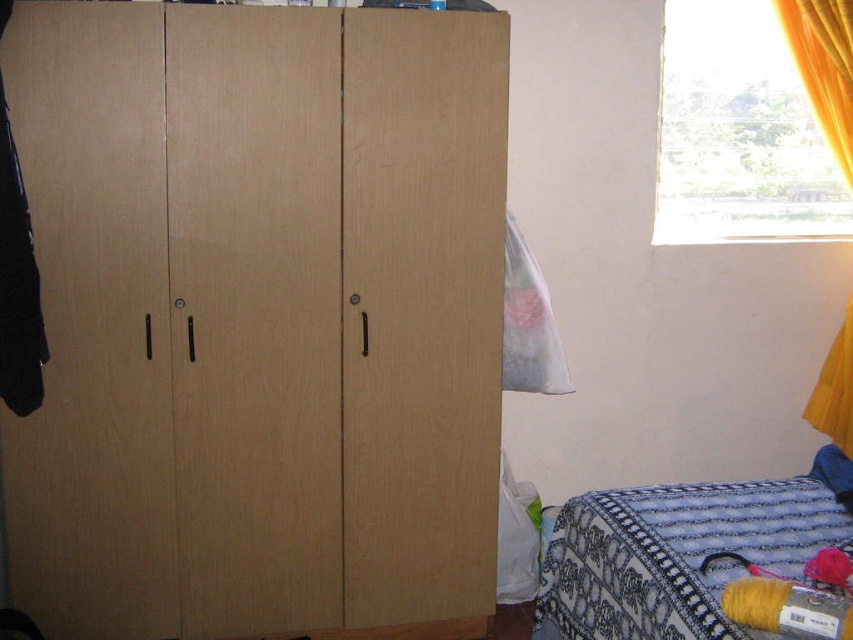
Is blue knitted blanket at lower right positioned at the back of yellow fabric curtain at upper right?

No, blue knitted blanket at lower right is closer to the viewer.

Between point (587, 616) and point (776, 12), which one is positioned behind?

Positioned behind is point (776, 12).

Find the location of a particular element. blue knitted blanket at lower right is located at coordinates (683, 552).

Based on the photo, between light brown wood dresser at left and blue knitted blanket at lower right, which one appears on the right side from the viewer's perspective?

blue knitted blanket at lower right

The height and width of the screenshot is (640, 853). I want to click on light brown wood dresser at left, so click(x=258, y=317).

At what (x,y) coordinates should I click in order to perform the action: click on light brown wood dresser at left. Please return your answer as a coordinate pair (x, y). This screenshot has width=853, height=640. Looking at the image, I should click on (258, 317).

Who is positioned more to the right, light brown wood dresser at left or yellow fabric curtain at upper right?

From the viewer's perspective, yellow fabric curtain at upper right appears more on the right side.

Is point (477, 532) more distant than point (834, 408)?

No, it is not.

Where is `light brown wood dresser at left`? Image resolution: width=853 pixels, height=640 pixels. light brown wood dresser at left is located at coordinates (258, 317).